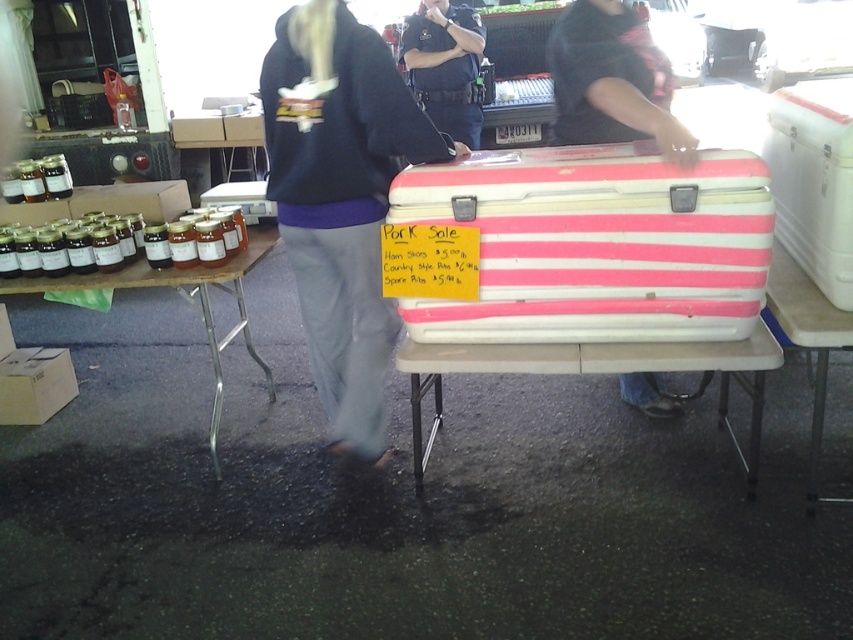
You are standing at the outdoor market and want to take a photo of the cooler with the yellow sign. There are two points marked on the cooler, one at coordinates point (544,198) and another at point (119,282). Which point should you focus on to ensure the cooler is in focus if you want the closer part of the cooler to be sharp?

You should focus on point (544,198) because it is closer to the camera than point (119,282), so focusing there will ensure the closer part of the cooler is sharp.